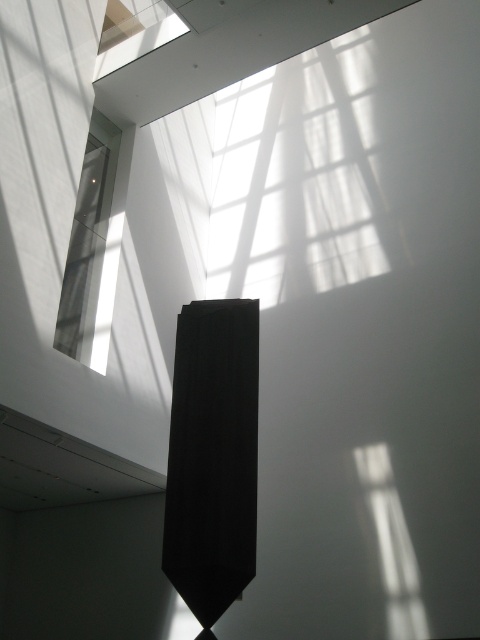
Question: Is matte black tie at center wider than clear glass window at upper left?

Choices:
 (A) no
 (B) yes

Answer: (A)

Question: Can you confirm if matte black tie at center is bigger than clear glass window at upper left?

Choices:
 (A) yes
 (B) no

Answer: (B)

Question: From the image, what is the correct spatial relationship of matte black tie at center in relation to clear glass window at upper left?

Choices:
 (A) below
 (B) above

Answer: (A)

Question: Which point appears farthest from the camera in this image?

Choices:
 (A) (103, 204)
 (B) (253, 481)

Answer: (A)

Question: Which point is farther to the camera?

Choices:
 (A) matte black tie at center
 (B) clear glass window at upper left

Answer: (B)